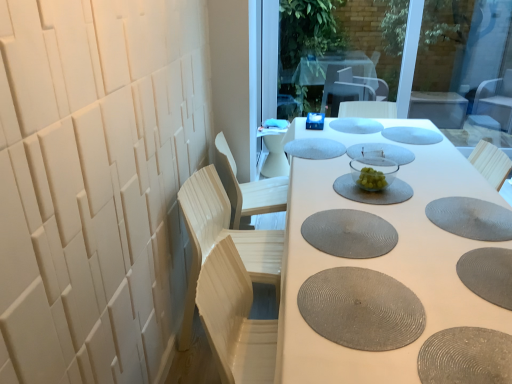
Where is `vacant space that's between clear glass bowl at center, which is the fourth manhole cover in back-to-front order, and clear glass bowl at center`? vacant space that's between clear glass bowl at center, which is the fourth manhole cover in back-to-front order, and clear glass bowl at center is located at coordinates (376, 170).